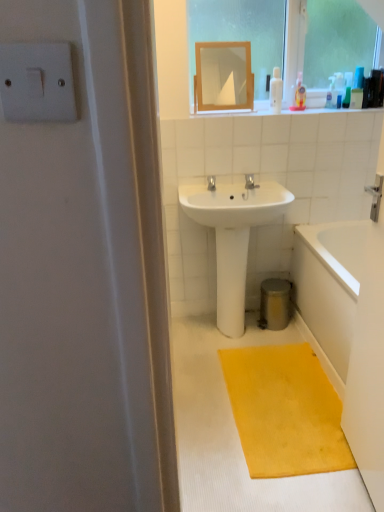
Question: Can wooden frame mirror at upper center be found inside white plastic light switch at upper left?

Choices:
 (A) yes
 (B) no

Answer: (B)

Question: From a real-world perspective, is white plastic light switch at upper left beneath wooden frame mirror at upper center?

Choices:
 (A) yes
 (B) no

Answer: (B)

Question: Is white plastic light switch at upper left oriented towards wooden frame mirror at upper center?

Choices:
 (A) yes
 (B) no

Answer: (B)

Question: From the image's perspective, is white plastic light switch at upper left located above wooden frame mirror at upper center?

Choices:
 (A) no
 (B) yes

Answer: (A)

Question: Can you confirm if white plastic light switch at upper left is shorter than wooden frame mirror at upper center?

Choices:
 (A) yes
 (B) no

Answer: (A)

Question: Is white plastic light switch at upper left to the right of wooden frame mirror at upper center from the viewer's perspective?

Choices:
 (A) no
 (B) yes

Answer: (A)

Question: Is white plastic bottle at upper right, the 1th toiletry positioned from the left, smaller than yellow textured mat at lower right?

Choices:
 (A) no
 (B) yes

Answer: (B)

Question: Is white plastic bottle at upper right, which is counted as the third toiletry, starting from the right, beside yellow textured mat at lower right?

Choices:
 (A) yes
 (B) no

Answer: (B)

Question: Is white plastic bottle at upper right, the 1th toiletry positioned from the left, facing away from yellow textured mat at lower right?

Choices:
 (A) no
 (B) yes

Answer: (A)

Question: From a real-world perspective, is white plastic bottle at upper right, the 1th toiletry positioned from the left, positioned over yellow textured mat at lower right based on gravity?

Choices:
 (A) yes
 (B) no

Answer: (A)

Question: Is white plastic bottle at upper right, which is counted as the third toiletry, starting from the right, further to camera compared to yellow textured mat at lower right?

Choices:
 (A) yes
 (B) no

Answer: (A)

Question: Is white plastic bottle at upper right, which is counted as the third toiletry, starting from the right, far from yellow textured mat at lower right?

Choices:
 (A) yes
 (B) no

Answer: (A)

Question: Considering the relative sizes of wooden frame mirror at upper center and translucent plastic soap dispenser at upper right, which appears as the second toiletry when viewed from the left, in the image provided, is wooden frame mirror at upper center bigger than translucent plastic soap dispenser at upper right, which appears as the second toiletry when viewed from the left,?

Choices:
 (A) no
 (B) yes

Answer: (B)